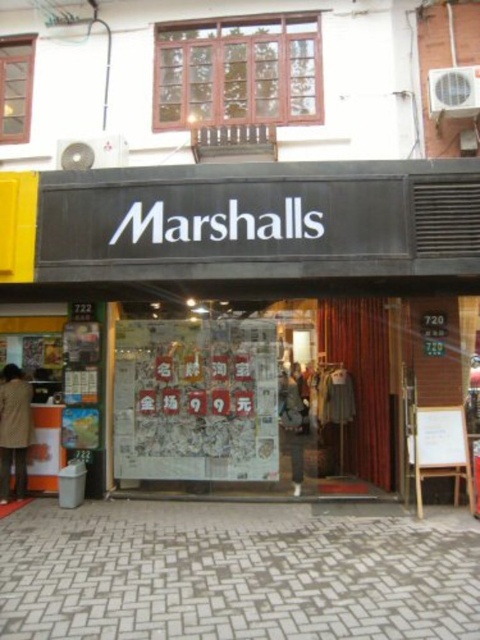
You are standing in front of the Marshalls store. You notice the matte black clothing store at center and the wooden frame at upper center. Which object is closer to you from your current position?

The matte black clothing store at center is closer to you because it is in front of the wooden frame at upper center.

You are a customer standing in front of the store. You notice the matte black clothing store at center and the wooden frame at upper center. Which object takes up more space in the scene?

The matte black clothing store at center is larger in size than the wooden frame at upper center, so it takes up more space in the scene.

Based on the photo, you are a delivery person standing at the entrance of the matte black clothing store at center. You need to place a package on the wooden frame at upper center. Can you reach it without using a ladder?

The distance between the matte black clothing store at center and the wooden frame at upper center is 4.42 meters. Since the wooden frame is 4.42 meters away from the store entrance, you would need a ladder or some form of elevation to reach it.